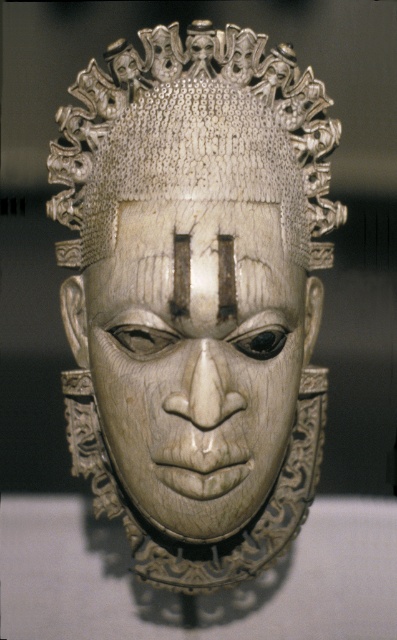
Who is positioned more to the left, ivory textured mask at center or ivory textured headdress at center?

ivory textured mask at center is more to the left.

Between ivory textured mask at center and ivory textured headdress at center, which one has less height?

With less height is ivory textured headdress at center.

Based on the photo, who is more distant from viewer, (167,524) or (248,147)?

A: The point (167,524) is more distant.

The width and height of the screenshot is (397, 640). In order to click on ivory textured mask at center in this screenshot , I will do `click(196, 298)`.

Between ivory textured headdress at center and white carved wood forehead at center, which one has more height?

ivory textured headdress at center

Between point (161, 32) and point (231, 225), which one is positioned in front?

Point (231, 225)

You are a GUI agent. You are given a task and a screenshot of the screen. Output one action in this format:
    pyautogui.click(x=<x>, y=<y>)
    Task: Click on the ivory textured headdress at center
    Image resolution: width=397 pixels, height=640 pixels.
    Given the screenshot: What is the action you would take?
    pyautogui.click(x=194, y=138)

Identify the location of ivory textured headdress at center. (194, 138).

Who is positioned more to the left, white carved wood mask at center or ivory textured headdress at center?

white carved wood mask at center

Which is in front, point (244, 364) or point (113, 109)?

Point (244, 364) is in front.

This screenshot has width=397, height=640. I want to click on white carved wood mask at center, so click(x=196, y=356).